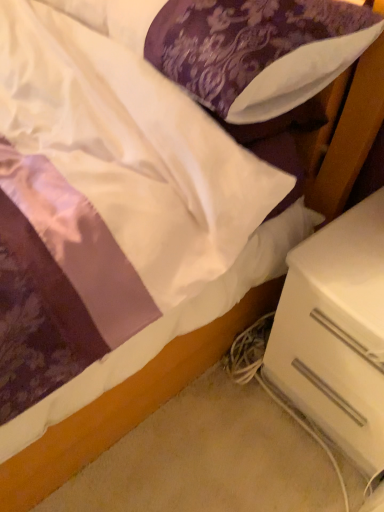
Question: Does white plastic drawer at lower right have a greater height compared to white satin pillow at upper center?

Choices:
 (A) no
 (B) yes

Answer: (B)

Question: Considering the relative positions of white plastic drawer at lower right and white satin pillow at upper center in the image provided, is white plastic drawer at lower right to the left of white satin pillow at upper center from the viewer's perspective?

Choices:
 (A) yes
 (B) no

Answer: (B)

Question: Can you confirm if white plastic drawer at lower right is thinner than white satin pillow at upper center?

Choices:
 (A) yes
 (B) no

Answer: (B)

Question: Can you confirm if white plastic drawer at lower right is wider than white satin pillow at upper center?

Choices:
 (A) yes
 (B) no

Answer: (A)

Question: Considering the relative positions of white plastic drawer at lower right and white satin pillow at upper center in the image provided, is white plastic drawer at lower right to the right of white satin pillow at upper center from the viewer's perspective?

Choices:
 (A) no
 (B) yes

Answer: (B)

Question: From the image's perspective, is white plastic drawer at lower right below white satin pillow at upper center?

Choices:
 (A) no
 (B) yes

Answer: (B)

Question: Is white satin pillow at upper center behind white plastic drawer at lower right?

Choices:
 (A) no
 (B) yes

Answer: (A)

Question: Can white plastic drawer at lower right be found inside white satin pillow at upper center?

Choices:
 (A) no
 (B) yes

Answer: (A)

Question: From the image's perspective, would you say white satin pillow at upper center is shown under white plastic drawer at lower right?

Choices:
 (A) no
 (B) yes

Answer: (A)

Question: From a real-world perspective, is white satin pillow at upper center over white plastic drawer at lower right?

Choices:
 (A) no
 (B) yes

Answer: (B)

Question: Considering the relative sizes of white satin pillow at upper center and white plastic drawer at lower right in the image provided, is white satin pillow at upper center bigger than white plastic drawer at lower right?

Choices:
 (A) no
 (B) yes

Answer: (A)

Question: Is white plastic drawer at lower right at the back of white satin pillow at upper center?

Choices:
 (A) yes
 (B) no

Answer: (B)

Question: In the image, is white plastic drawer at lower right positioned in front of or behind white satin pillow at upper center?

Choices:
 (A) behind
 (B) front

Answer: (A)